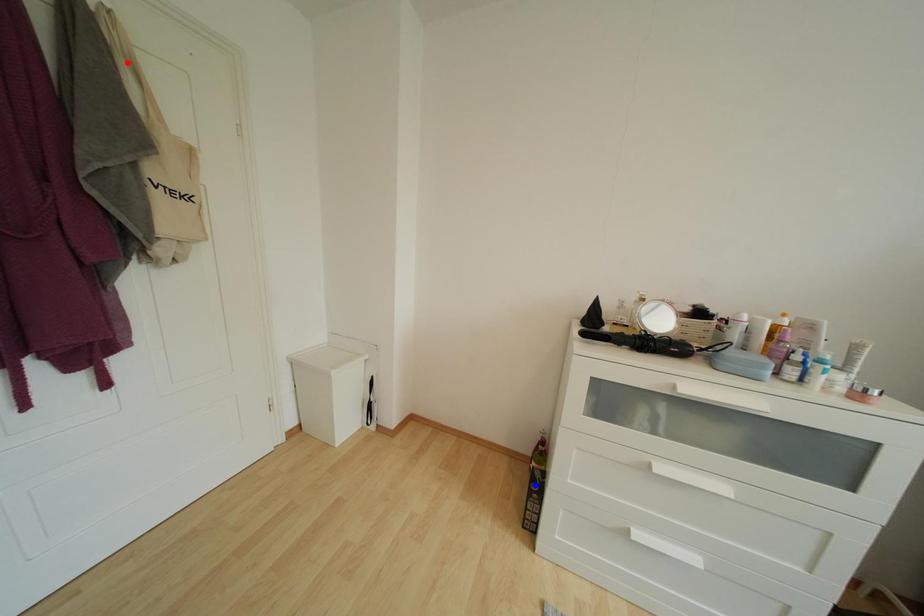
Question: Which of the two points in the image is closer to the camera?

Choices:
 (A) Blue point is closer.
 (B) Red point is closer.

Answer: (B)